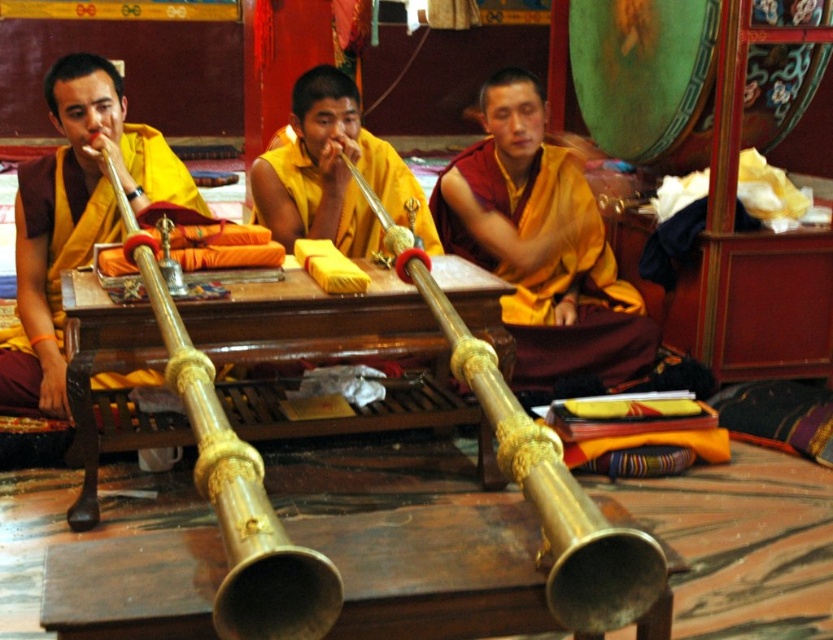
Can you confirm if matte gold horn at left is wider than gold polished trumpet at left?

Incorrect, matte gold horn at left's width does not surpass gold polished trumpet at left's.

What do you see at coordinates (75, 218) in the screenshot? This screenshot has width=833, height=640. I see `matte gold horn at left` at bounding box center [75, 218].

Image resolution: width=833 pixels, height=640 pixels. What are the coordinates of `matte gold horn at left` in the screenshot? It's located at (75, 218).

Who is positioned more to the left, gold polished trumpet at left or yellow silk monk at center?

Positioned to the left is gold polished trumpet at left.

This screenshot has height=640, width=833. I want to click on gold polished trumpet at left, so click(x=233, y=484).

Is point (278, 552) more distant than point (307, 176)?

No, (278, 552) is closer to viewer.

Locate an element on the screen. This screenshot has width=833, height=640. gold polished trumpet at left is located at coordinates (233, 484).

Is point (535, 168) positioned behind point (328, 176)?

Yes, point (535, 168) is farther from viewer.

Which is below, maroon silk robe at center or yellow silk monk at center?

maroon silk robe at center is below.

Is point (544, 317) positioned after point (335, 154)?

That is True.

Where is `maroon silk robe at center`? This screenshot has height=640, width=833. maroon silk robe at center is located at coordinates (541, 244).